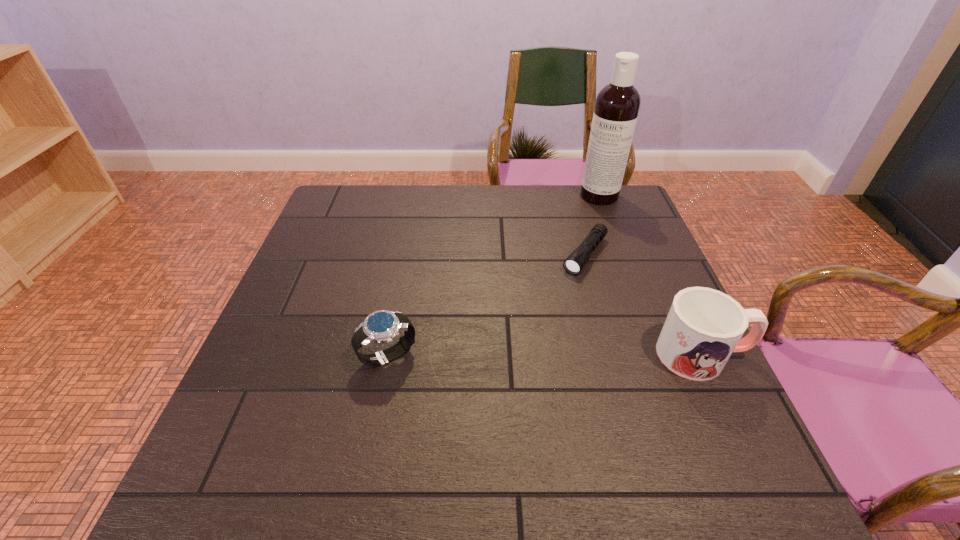
Locate an element on the screen. Image resolution: width=960 pixels, height=540 pixels. blank space located 0.320m at the lens end of the second farthest object is located at coordinates (515, 354).

Locate an element on the screen. This screenshot has width=960, height=540. vacant area situated on the label side of the tallest object is located at coordinates (570, 272).

Identify the location of free space located on the label side of the tallest object. The width and height of the screenshot is (960, 540). (580, 246).

Find the location of a particular element. vacant space positioned 0.280m on the label side of the tallest object is located at coordinates (x=576, y=257).

Find the location of a particular element. This screenshot has height=540, width=960. object located in the far edge section of the desktop is located at coordinates (617, 105).

Find the location of `mug that is at the right edge`. mug that is at the right edge is located at coordinates point(704,326).

The height and width of the screenshot is (540, 960). I want to click on flashlight located in the right edge section of the desktop, so click(x=575, y=262).

Locate an element on the screen. dishwasher detergent situated at the right edge is located at coordinates (617, 105).

Where is `object located at the far right corner`? The width and height of the screenshot is (960, 540). object located at the far right corner is located at coordinates (617, 105).

Locate an element on the screen. vacant point at the far edge is located at coordinates (402, 189).